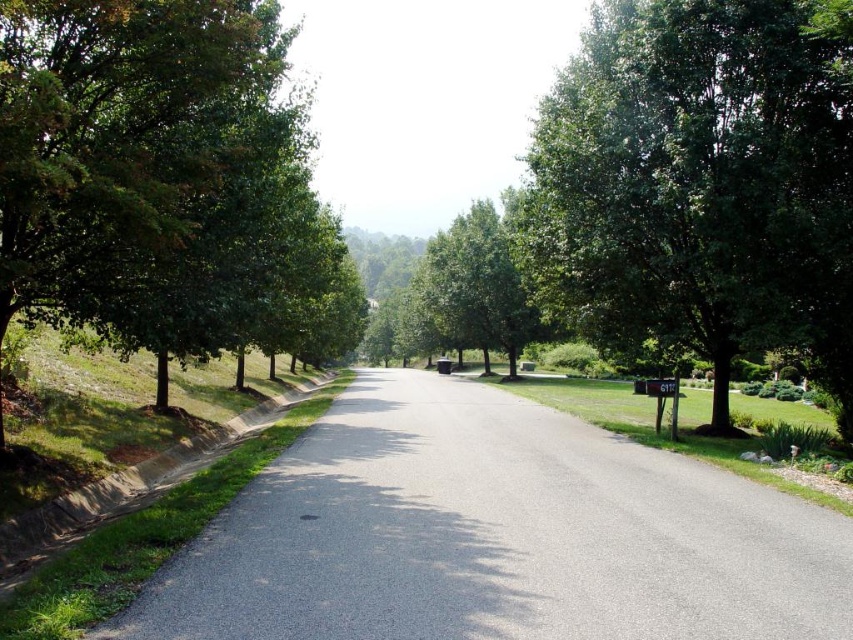
Between gray asphalt road at center and green leafy tree at right, which one appears on the left side from the viewer's perspective?

gray asphalt road at center

Is gray asphalt road at center behind green leafy tree at right?

No.

Locate an element on the screen. Image resolution: width=853 pixels, height=640 pixels. gray asphalt road at center is located at coordinates (495, 536).

Does green leafy tree at left lie behind green leafy tree at center?

No, green leafy tree at left is in front of green leafy tree at center.

At what (x,y) coordinates should I click in order to perform the action: click on green leafy tree at left. Please return your answer as a coordinate pair (x, y). Looking at the image, I should click on (155, 173).

Can you confirm if green leafy tree at right is positioned below green leafy tree at left?

Indeed, green leafy tree at right is positioned under green leafy tree at left.

Who is taller, green leafy tree at right or green leafy tree at left?

With more height is green leafy tree at left.

Between point (828, 248) and point (189, 326), which one is positioned in front?

Point (189, 326)

Where is `green leafy tree at right`? The width and height of the screenshot is (853, 640). green leafy tree at right is located at coordinates (701, 184).